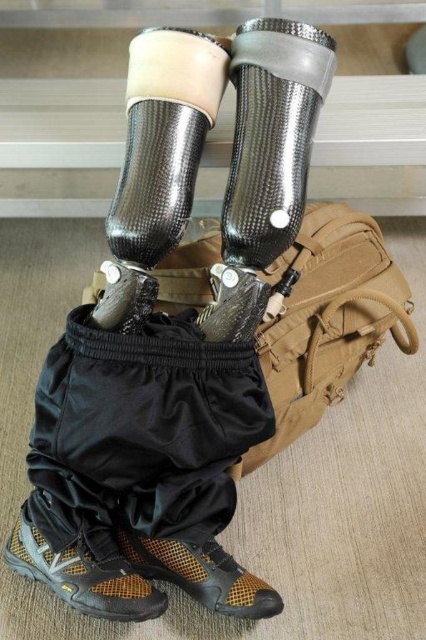
You are examining the prosthetic legs in the image. There are two points marked on them. One is at coordinate point (103, 596) and the other at point (213, 568). Which of these points is closer to you?

Point (103, 596) is closer to the viewer than point (213, 568).

You are a physical therapist examining a patient who has two shoes on their prosthetic legs. The shoes are labeled as the textured brown shoe at lower left and the brown mesh shoe at lower left. The patient wants to know which shoe is covering the other. Based on the scene, which shoe is on top?

The textured brown shoe at lower left is positioned over the brown mesh shoe at lower left, so the textured brown shoe at lower left is on top.